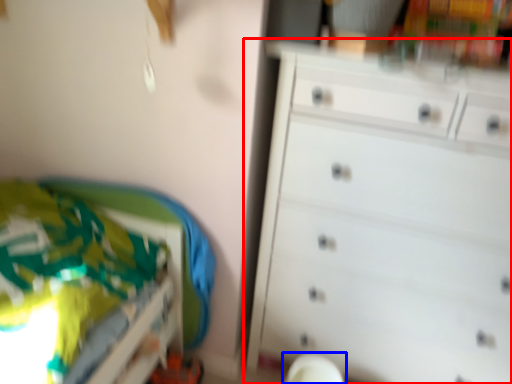
Question: Which object is further to the camera taking this photo, chest of drawers (highlighted by a red box) or swivel chair (highlighted by a blue box)?

Choices:
 (A) chest of drawers
 (B) swivel chair

Answer: (B)